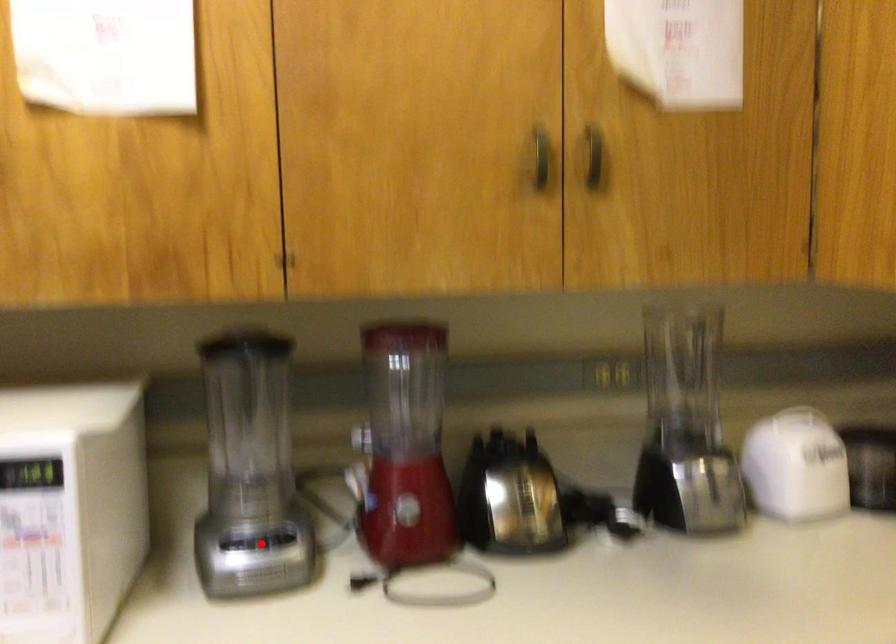
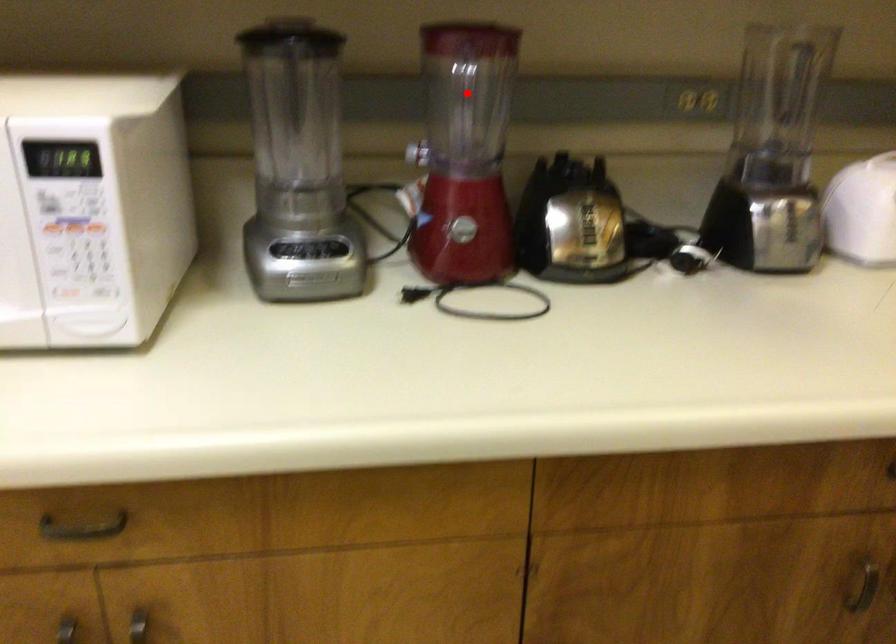
I am providing you with two images of the same scene from different viewpoints. A red point is marked on the first image and another point is marked on the second image. Is the marked point in image1 the same physical position as the marked point in image2?

No